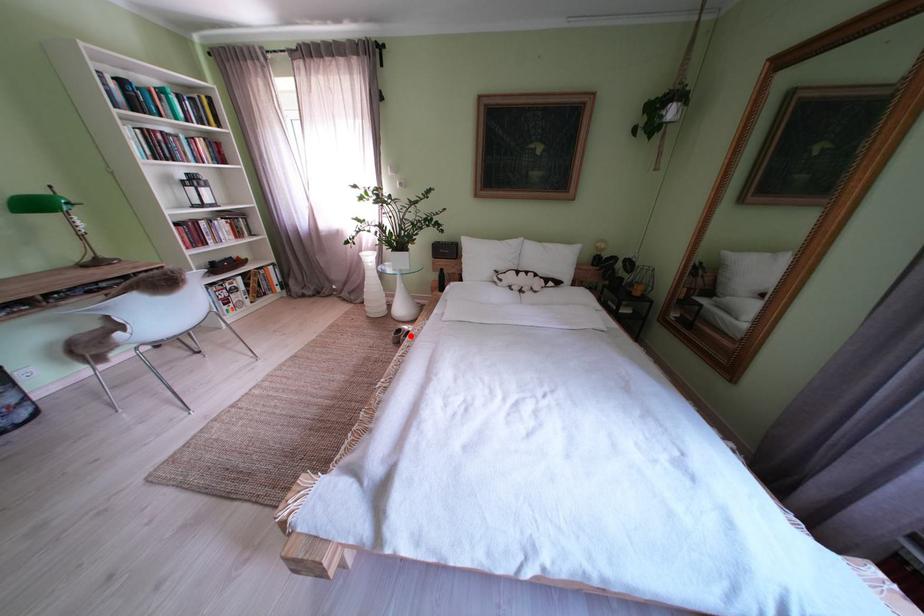
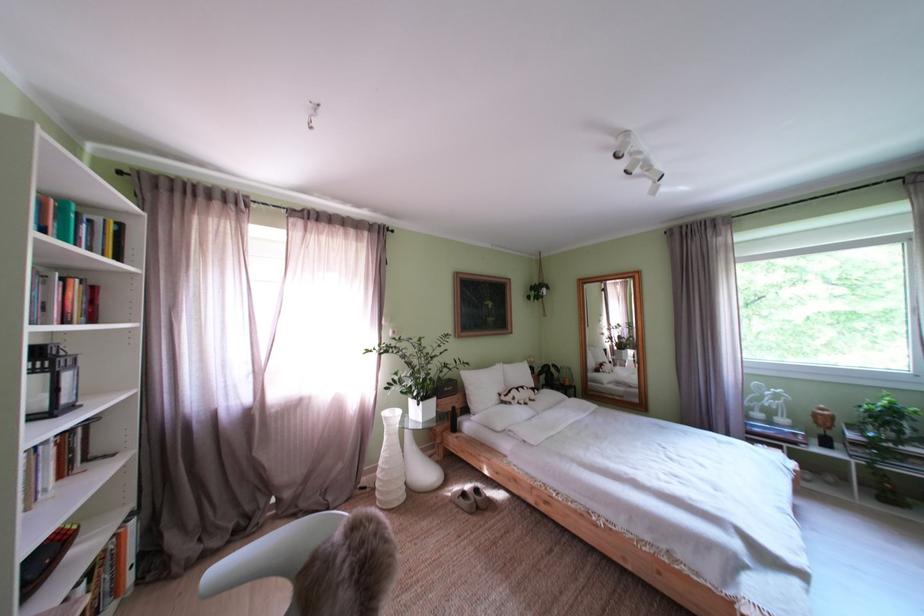
The point at the highlighted location is marked in the first image. Where is the corresponding point in the second image?

(475, 500)